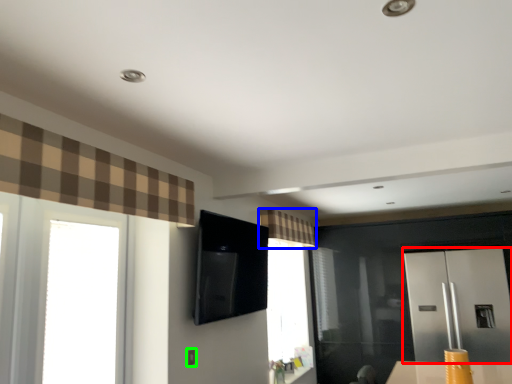
Question: Which object is positioned closest to screen door (highlighted by a red box)? Select from curtain (highlighted by a blue box) and electric outlet (highlighted by a green box).

Choices:
 (A) curtain
 (B) electric outlet

Answer: (A)